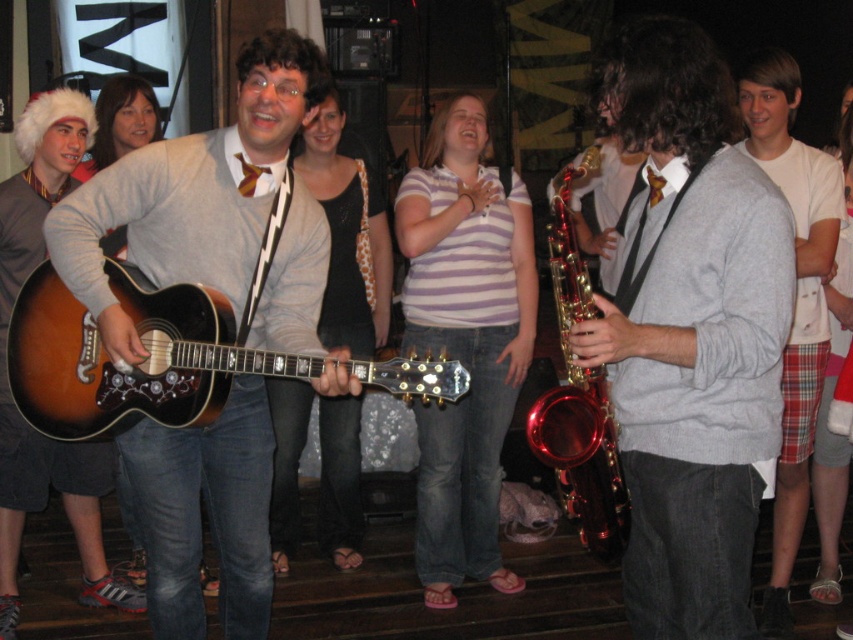
Who is lower down, striped cotton shirt at center or matte black guitar at center?

striped cotton shirt at center

Can you confirm if striped cotton shirt at center is smaller than matte black guitar at center?

Correct, striped cotton shirt at center occupies less space than matte black guitar at center.

Where is `striped cotton shirt at center`? striped cotton shirt at center is located at coordinates (463, 340).

Is point (453, 160) in front of point (773, 99)?

No, it is not.

Can you confirm if striped cotton shirt at center is positioned to the right of white cotton t-shirt at right?

In fact, striped cotton shirt at center is to the left of white cotton t-shirt at right.

Is point (426, 337) behind point (833, 202)?

Yes, point (426, 337) is behind point (833, 202).

In order to click on striped cotton shirt at center in this screenshot , I will do `click(463, 340)`.

Who is positioned more to the right, matte gray sweater at center or matte black guitar at center?

matte gray sweater at center is more to the right.

Does matte gray sweater at center appear under matte black guitar at center?

Indeed, matte gray sweater at center is positioned under matte black guitar at center.

Between point (677, 406) and point (361, 220), which one is positioned behind?

Point (361, 220)

At what (x,y) coordinates should I click in order to perform the action: click on matte gray sweater at center. Please return your answer as a coordinate pair (x, y). Image resolution: width=853 pixels, height=640 pixels. Looking at the image, I should click on (691, 333).